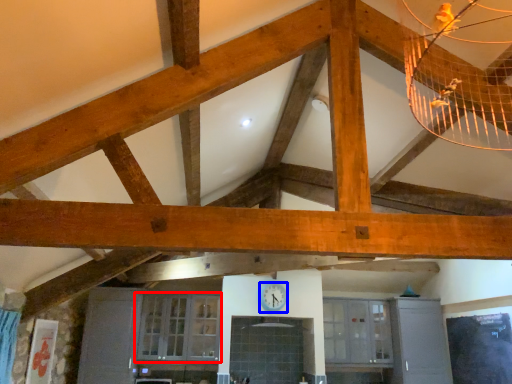
Question: Which object is further to the camera taking this photo, window (highlighted by a red box) or clock (highlighted by a blue box)?

Choices:
 (A) window
 (B) clock

Answer: (B)